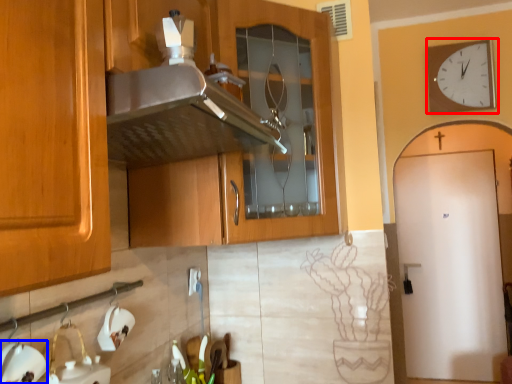
Question: Among these objects, which one is farthest to the camera, wall clock (highlighted by a red box) or appliance (highlighted by a blue box)?

Choices:
 (A) wall clock
 (B) appliance

Answer: (A)